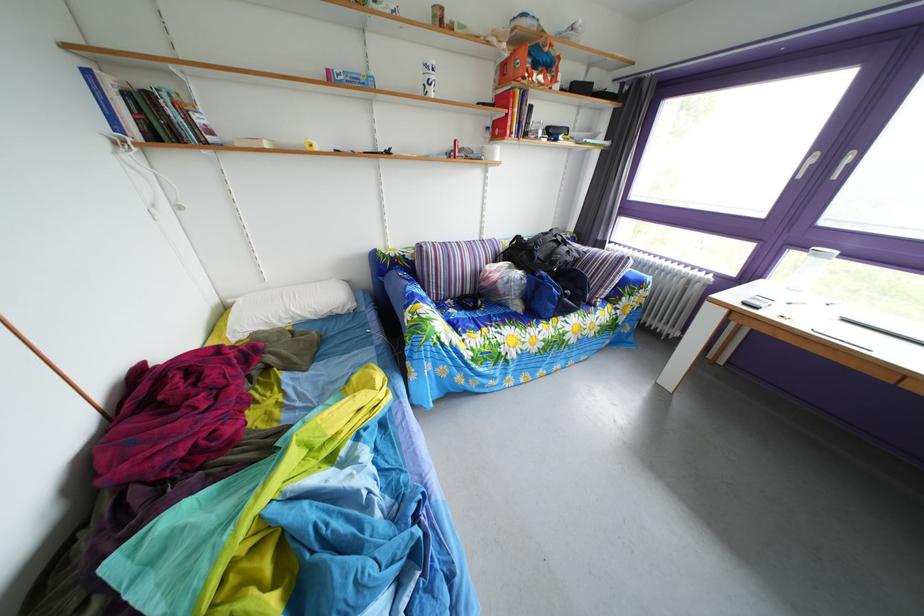
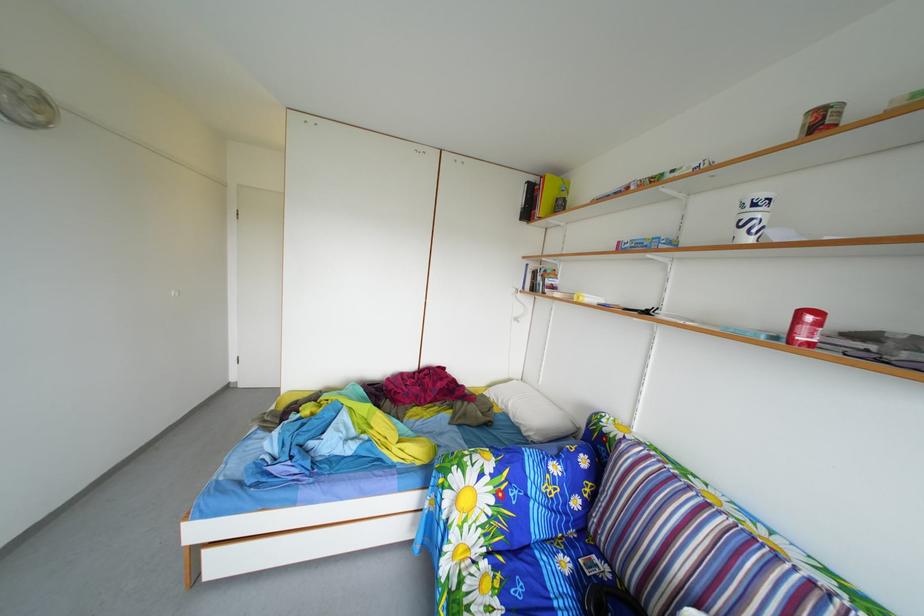
The point at (x=463, y=320) is marked in the first image. Where is the corresponding point in the second image?

(576, 570)